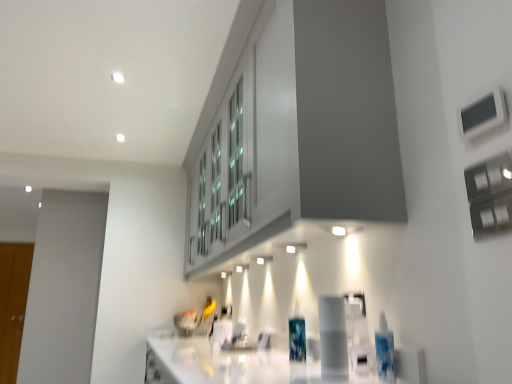
What is the approximate width of wooden glass door at left?

It is 10.11 centimeters.

Where is `wooden glass door at left`? Image resolution: width=512 pixels, height=384 pixels. wooden glass door at left is located at coordinates (13, 304).

What is the approximate height of white glossy countertop at lower center?

It is 17.76 inches.

Locate an element on the screen. This screenshot has width=512, height=384. translucent plastic bottle at center is located at coordinates (297, 335).

Identify the location of wooden glass door at left. (13, 304).

Which of these two, translucent plastic bottle at center or wooden glass door at left, is bigger?

wooden glass door at left is bigger.

Is translucent plastic bottle at center taller or shorter than wooden glass door at left?

translucent plastic bottle at center is shorter than wooden glass door at left.

Looking at this image, does translucent plastic bottle at center touch wooden glass door at left?

No, translucent plastic bottle at center is not with wooden glass door at left.

Is wooden glass door at left not within white glossy countertop at lower center?

Indeed, wooden glass door at left is completely outside white glossy countertop at lower center.

Considering the sizes of objects wooden glass door at left and white glossy countertop at lower center in the image provided, who is bigger, wooden glass door at left or white glossy countertop at lower center?

Bigger between the two is white glossy countertop at lower center.

Consider the image. Would you consider wooden glass door at left to be distant from white glossy countertop at lower center?

Yes, wooden glass door at left and white glossy countertop at lower center are quite far apart.

Which is farther, (23, 252) or (169, 344)?

The point (23, 252) is farther.

Looking at their sizes, would you say wooden glass door at left is wider or thinner than translucent plastic bottle at center?

wooden glass door at left is thinner than translucent plastic bottle at center.

In terms of height, does wooden glass door at left look taller or shorter compared to translucent plastic bottle at center?

Clearly, wooden glass door at left is taller compared to translucent plastic bottle at center.

Is the position of wooden glass door at left less distant than that of translucent plastic bottle at center?

No, wooden glass door at left is behind translucent plastic bottle at center.

From the image's perspective, which is above, wooden glass door at left or translucent plastic bottle at center?

translucent plastic bottle at center.

From the picture: Considering the relative positions of white glossy countertop at lower center and translucent plastic bottle at center in the image provided, is white glossy countertop at lower center to the left of translucent plastic bottle at center from the viewer's perspective?

Indeed, white glossy countertop at lower center is positioned on the left side of translucent plastic bottle at center.

Identify the location of countertop located on the left of translucent plastic bottle at center. The height and width of the screenshot is (384, 512). (226, 364).

Is white glossy countertop at lower center situated inside translucent plastic bottle at center or outside?

white glossy countertop at lower center is not enclosed by translucent plastic bottle at center.

In the scene shown: In terms of width, does white glossy countertop at lower center look wider or thinner when compared to translucent plastic bottle at center?

Considering their sizes, white glossy countertop at lower center looks broader than translucent plastic bottle at center.

From the picture: From a real-world perspective, is white glossy countertop at lower center positioned above or below wooden glass door at left?

In terms of real-world spatial position, white glossy countertop at lower center is below wooden glass door at left.

Which object is closer to the camera taking this photo, white glossy countertop at lower center or wooden glass door at left?

white glossy countertop at lower center is closer to the camera.

Looking at this image, from the image's perspective, which is above, white glossy countertop at lower center or wooden glass door at left?

From the image's view, white glossy countertop at lower center is above.

Does translucent plastic bottle at center have a greater width compared to white glossy countertop at lower center?

In fact, translucent plastic bottle at center might be narrower than white glossy countertop at lower center.

Is translucent plastic bottle at center next to white glossy countertop at lower center and touching it?

No, translucent plastic bottle at center is not in contact with white glossy countertop at lower center.

You are a GUI agent. You are given a task and a screenshot of the screen. Output one action in this format:
    pyautogui.click(x=<x>, y=<y>)
    Task: Click on the countertop lying on the left of translucent plastic bottle at center
    This screenshot has width=512, height=384.
    Given the screenshot: What is the action you would take?
    pyautogui.click(x=226, y=364)

Looking at the image, does translucent plastic bottle at center seem bigger or smaller compared to white glossy countertop at lower center?

Clearly, translucent plastic bottle at center is smaller in size than white glossy countertop at lower center.

This screenshot has width=512, height=384. There is a translucent plastic bottle at center. Find the location of `glass door above it (from a real-world perspective)`. glass door above it (from a real-world perspective) is located at coordinates (13, 304).

In the image, there is a white glossy countertop at lower center. Where is `glass door below it (from the image's perspective)`? Image resolution: width=512 pixels, height=384 pixels. glass door below it (from the image's perspective) is located at coordinates pos(13,304).

Looking at the image, which one is located further to wooden glass door at left, translucent plastic bottle at center or white glossy countertop at lower center?

translucent plastic bottle at center lies further to wooden glass door at left than the other object.

Considering their positions, is translucent plastic bottle at center positioned closer to white glossy countertop at lower center than wooden glass door at left?

Among the two, translucent plastic bottle at center is located nearer to white glossy countertop at lower center.

Considering their positions, is white glossy countertop at lower center positioned closer to wooden glass door at left than translucent plastic bottle at center?

white glossy countertop at lower center is positioned closer to the anchor wooden glass door at left.

Based on their spatial positions, is white glossy countertop at lower center or wooden glass door at left closer to translucent plastic bottle at center?

white glossy countertop at lower center lies closer to translucent plastic bottle at center than the other object.

Based on the photo, which object lies nearer to the anchor point translucent plastic bottle at center, wooden glass door at left or white glossy countertop at lower center?

Based on the image, white glossy countertop at lower center appears to be nearer to translucent plastic bottle at center.

When comparing their distances from white glossy countertop at lower center, does wooden glass door at left or translucent plastic bottle at center seem further?

Based on the image, wooden glass door at left appears to be further to white glossy countertop at lower center.

Find the location of a particular element. bottle between white glossy countertop at lower center and wooden glass door at left from front to back is located at coordinates (297, 335).